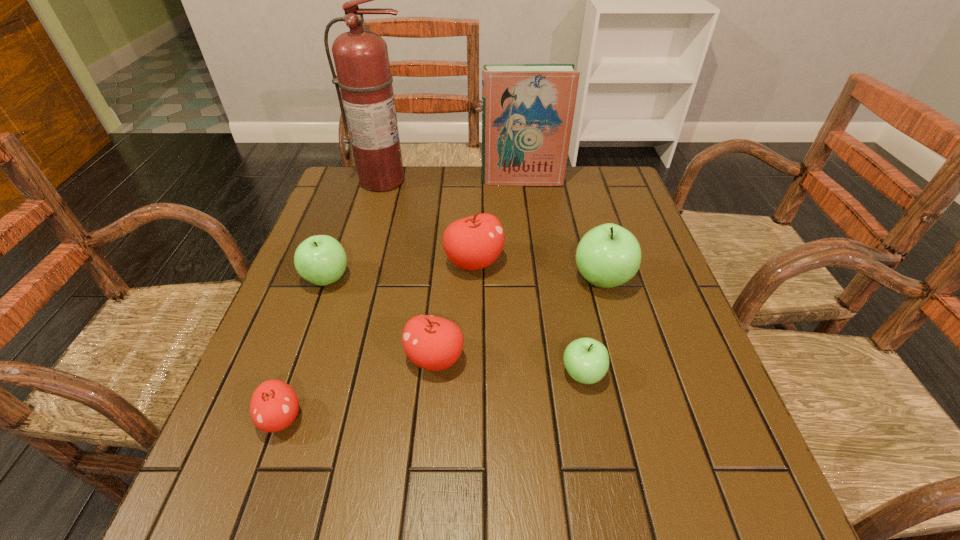
Image resolution: width=960 pixels, height=540 pixels. I want to click on object that is at the right edge, so click(x=607, y=256).

The width and height of the screenshot is (960, 540). I want to click on object present at the far left corner, so click(x=361, y=59).

In the image, there is a desktop. Where is `vacant space at the far edge`? The width and height of the screenshot is (960, 540). vacant space at the far edge is located at coordinates (461, 201).

At what (x,y) coordinates should I click in order to perform the action: click on vacant area at the near edge. Please return your answer as a coordinate pair (x, y). This screenshot has height=540, width=960. Looking at the image, I should click on (535, 480).

Identify the location of vacant space at the left edge of the desktop. This screenshot has width=960, height=540. (257, 386).

The height and width of the screenshot is (540, 960). Identify the location of vacant space at the right edge. (675, 319).

Locate an element on the screen. This screenshot has height=540, width=960. vacant region at the near left corner of the desktop is located at coordinates (254, 510).

This screenshot has height=540, width=960. Find the location of `free region at the far right corner of the desktop`. free region at the far right corner of the desktop is located at coordinates (627, 187).

Where is `vacant space at the near right corner`? The width and height of the screenshot is (960, 540). vacant space at the near right corner is located at coordinates (715, 481).

Where is `empty space between the hardback book and the biggest green apple`? empty space between the hardback book and the biggest green apple is located at coordinates (562, 230).